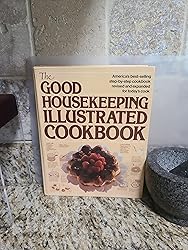
The image size is (188, 250). In order to click on countertop in this screenshot , I will do `click(93, 220)`.